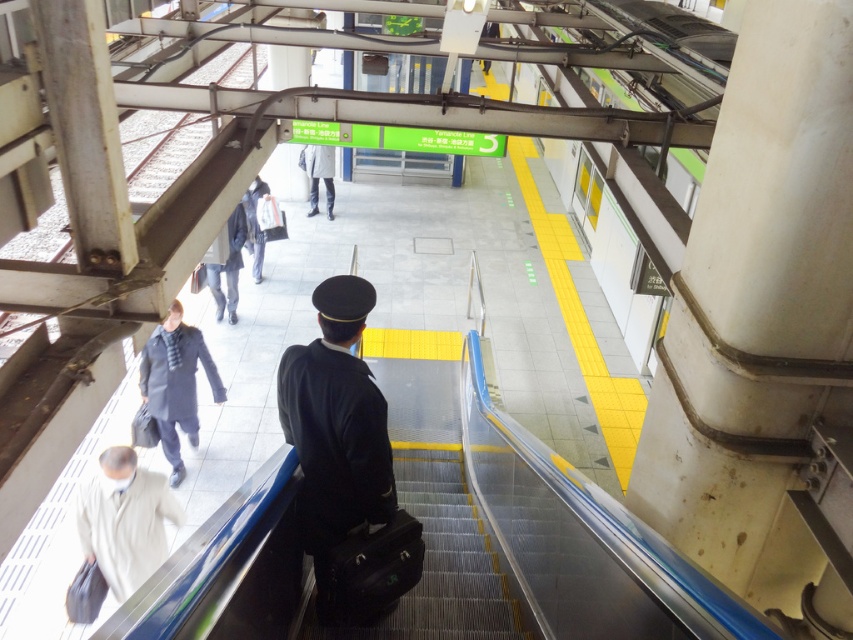
Question: Is light beige fabric coat at lower left bigger than dark gray uniform at center?

Choices:
 (A) yes
 (B) no

Answer: (B)

Question: Observing the image, what is the correct spatial positioning of light gray coat at center in reference to dark gray uniform at center?

Choices:
 (A) left
 (B) right

Answer: (B)

Question: Which object is closer to the camera taking this photo?

Choices:
 (A) dark gray fabric coat at center
 (B) dark blue uniform at center
 (C) light gray coat at center

Answer: (B)

Question: Which point appears closest to the camera in this image?

Choices:
 (A) (155, 330)
 (B) (315, 211)

Answer: (A)

Question: Which point appears closest to the camera in this image?

Choices:
 (A) (315, 164)
 (B) (193, 353)

Answer: (B)

Question: Is matte gray coat at lower left thinner than dark gray fabric coat at center?

Choices:
 (A) yes
 (B) no

Answer: (B)